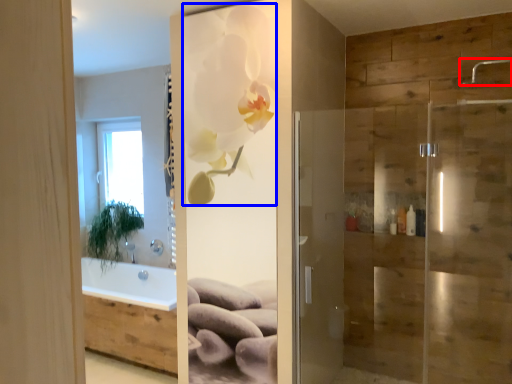
Question: Among these objects, which one is farthest to the camera, shower (highlighted by a red box) or floral arrangement (highlighted by a blue box)?

Choices:
 (A) shower
 (B) floral arrangement

Answer: (B)